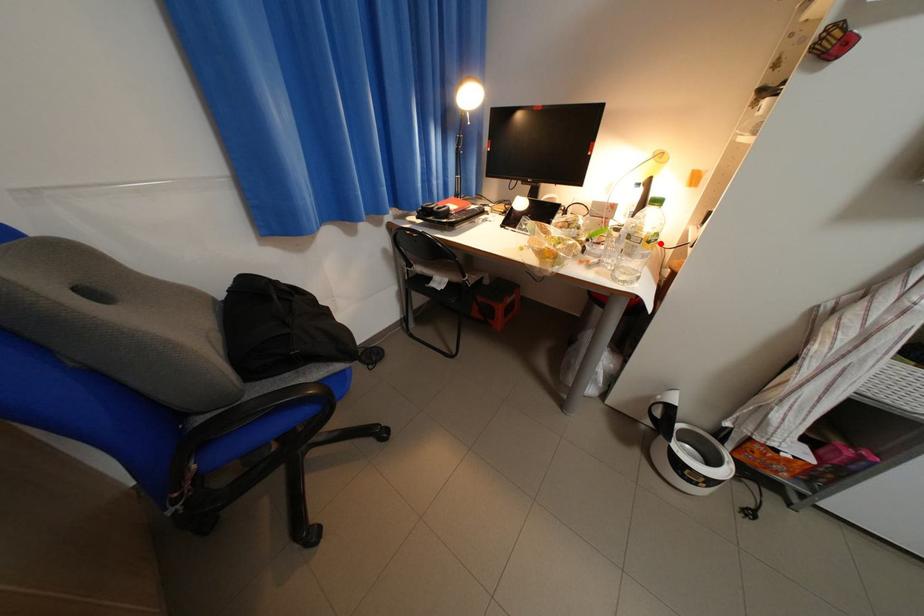
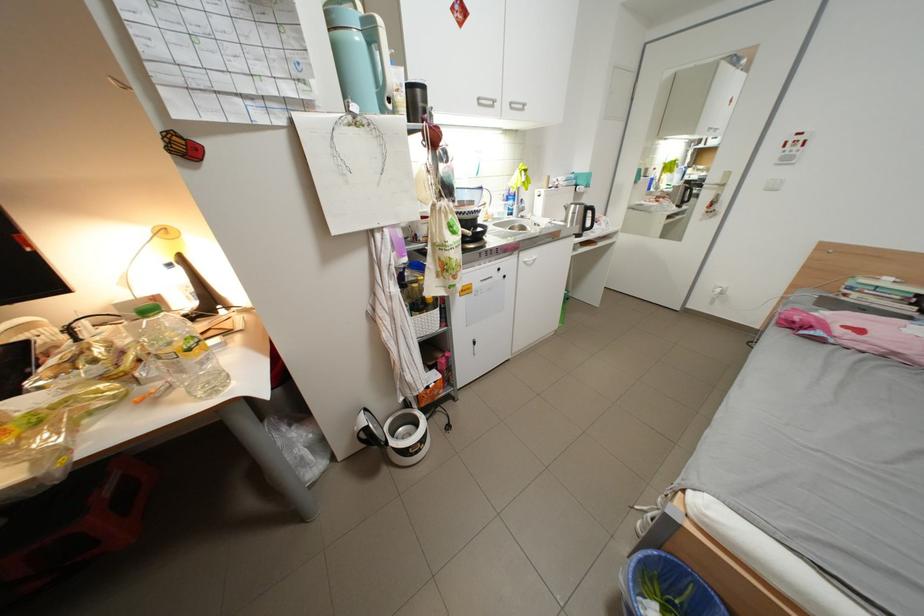
The point at the highlighted location is marked in the first image. Where is the corresponding point in the second image?

(201, 351)